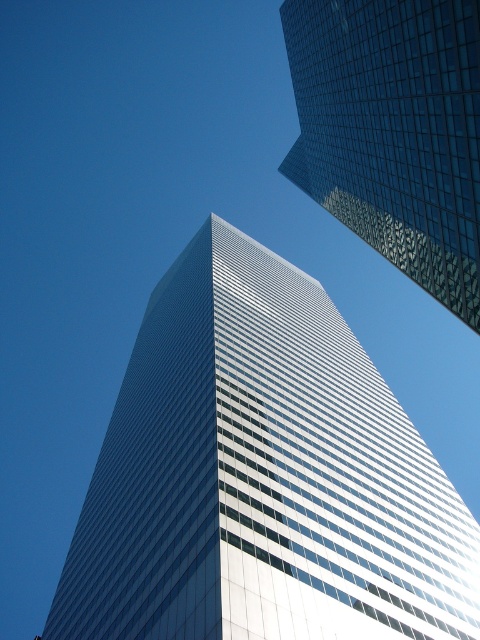
Question: Is glassy reflective skyscraper at center thinner than glassy reflective skyscraper at upper right?

Choices:
 (A) yes
 (B) no

Answer: (B)

Question: Is glassy reflective skyscraper at center bigger than glassy reflective skyscraper at upper right?

Choices:
 (A) no
 (B) yes

Answer: (B)

Question: Can you confirm if glassy reflective skyscraper at center is thinner than glassy reflective skyscraper at upper right?

Choices:
 (A) yes
 (B) no

Answer: (B)

Question: Which object is farther from the camera taking this photo?

Choices:
 (A) glassy reflective skyscraper at center
 (B) glassy reflective skyscraper at upper right

Answer: (B)

Question: Which of the following is the closest to the observer?

Choices:
 (A) (396, 220)
 (B) (157, 404)

Answer: (A)